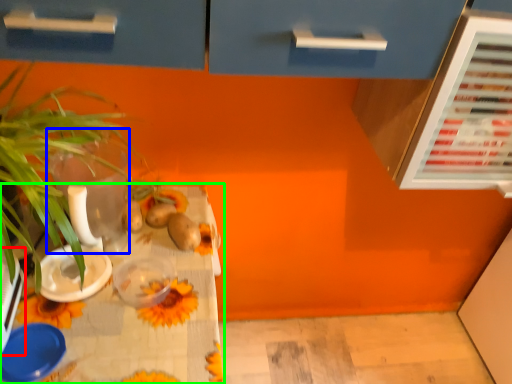
Question: Which is nearer to the appliance (highlighted by a red box)? glass vase (highlighted by a blue box) or table (highlighted by a green box).

Choices:
 (A) glass vase
 (B) table

Answer: (B)